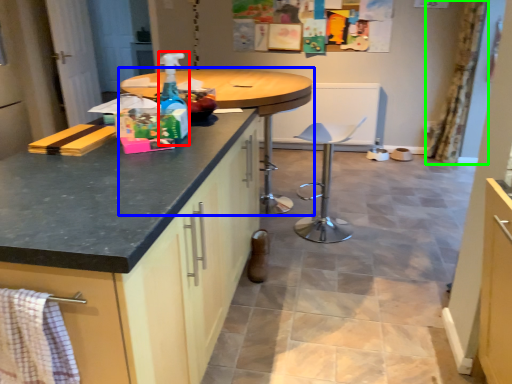
Question: Which object is positioned farthest from bottle (highlighted by a red box)? Select from table (highlighted by a blue box) and curtain (highlighted by a green box).

Choices:
 (A) table
 (B) curtain

Answer: (B)